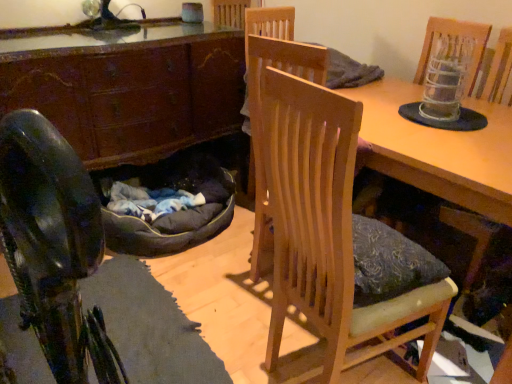
In order to face dark brown wood cabinet at left, should I rotate leftwards or rightwards?

Rotate left and turn 16.317 degrees.

What do you see at coordinates (440, 149) in the screenshot?
I see `wooden table at center` at bounding box center [440, 149].

The height and width of the screenshot is (384, 512). Describe the element at coordinates (319, 215) in the screenshot. I see `wooden chair at center` at that location.

At what (x,y) coordinates should I click in order to perform the action: click on dark gray fabric bean bag at lower left. Please return your answer as a coordinate pair (x, y). This screenshot has height=384, width=512. Looking at the image, I should click on (168, 206).

Is wooden chair at center taller or shorter than dark brown wood cabinet at left?

In the image, wooden chair at center appears to be taller than dark brown wood cabinet at left.

Between point (420, 333) and point (134, 111), which one is positioned in front?

The point (420, 333) is in front.

Which point is more forward, (62, 88) or (175, 186)?

The point (62, 88) is in front.

From the image's perspective, is dark brown wood cabinet at left above or below dark gray fabric bean bag at lower left?

Clearly, from the image's perspective, dark brown wood cabinet at left is above dark gray fabric bean bag at lower left.

The height and width of the screenshot is (384, 512). What are the coordinates of `bean bag chair below the dark brown wood cabinet at left (from a real-world perspective)` in the screenshot? It's located at (168, 206).

From the picture: From a real-world perspective, is dark gray fabric bean bag at lower left located beneath wooden chair at center?

Correct, in the physical world, dark gray fabric bean bag at lower left is lower than wooden chair at center.

From the image's perspective, is dark gray fabric bean bag at lower left under wooden chair at center?

No.

The image size is (512, 384). Find the location of `chair positioned vertically above the dark gray fabric bean bag at lower left (from a real-world perspective)`. chair positioned vertically above the dark gray fabric bean bag at lower left (from a real-world perspective) is located at coordinates (319, 215).

Considering the positions of objects dark gray fabric bean bag at lower left and wooden chair at center in the image provided, who is in front, dark gray fabric bean bag at lower left or wooden chair at center?

Positioned in front is wooden chair at center.

Could you tell me if wooden chair at center is turned towards wooden table at center?

No.

From the image's perspective, which is below, wooden chair at center or wooden table at center?

From the image's view, wooden chair at center is below.

Is the depth of wooden chair at center less than that of wooden table at center?

Yes, wooden chair at center is closer to the viewer.

From a real-world perspective, is wooden chair at center physically located above or below wooden table at center?

wooden chair at center is below wooden table at center.

Considering the relative sizes of dark gray fabric bean bag at lower left and wooden table at center in the image provided, is dark gray fabric bean bag at lower left bigger than wooden table at center?

Incorrect, dark gray fabric bean bag at lower left is not larger than wooden table at center.

In the scene shown: From the image's perspective, between dark gray fabric bean bag at lower left and wooden table at center, which one is located above?

wooden table at center is shown above in the image.

Considering the relative sizes of dark gray fabric bean bag at lower left and wooden table at center in the image provided, is dark gray fabric bean bag at lower left wider than wooden table at center?

Yes, dark gray fabric bean bag at lower left is wider than wooden table at center.

Does dark gray fabric bean bag at lower left appear on the right side of wooden table at center?

Incorrect, dark gray fabric bean bag at lower left is not on the right side of wooden table at center.

Is wooden table at center bigger or smaller than wooden chair at center?

wooden table at center is smaller than wooden chair at center.

Is wooden table at center wider than wooden chair at center?

Yes.

From a real-world perspective, is wooden table at center located higher than wooden chair at center?

Indeed, from a real-world perspective, wooden table at center stands above wooden chair at center.

Which object is closer to the camera taking this photo, wooden table at center or wooden chair at center?

wooden chair at center.

Can you confirm if wooden chair at center is smaller than dark gray fabric bean bag at lower left?

No.

Can you tell me how much wooden chair at center and dark gray fabric bean bag at lower left differ in facing direction?

There is a 89.1-degree angle between the facing directions of wooden chair at center and dark gray fabric bean bag at lower left.

Does point (346, 336) lie behind point (210, 208)?

That is False.

From the image's perspective, between wooden chair at center and dark gray fabric bean bag at lower left, who is located below?

wooden chair at center.

I want to click on chair to the right of dark brown wood cabinet at left, so click(x=319, y=215).

There is a dark gray fabric bean bag at lower left. Identify the location of cabinetry above it (from a real-world perspective). This screenshot has height=384, width=512. tap(128, 87).

Considering their positions, is dark brown wood cabinet at left positioned closer to wooden chair at center than dark gray fabric bean bag at lower left?

The object closer to wooden chair at center is dark gray fabric bean bag at lower left.

When comparing their distances from wooden table at center, does dark gray fabric bean bag at lower left or wooden chair at center seem further?

dark gray fabric bean bag at lower left.

Which object lies further to the anchor point dark gray fabric bean bag at lower left, wooden table at center or dark brown wood cabinet at left?

Based on the image, wooden table at center appears to be further to dark gray fabric bean bag at lower left.

Based on their spatial positions, is wooden table at center or dark brown wood cabinet at left further from wooden chair at center?

Among the two, dark brown wood cabinet at left is located further to wooden chair at center.

Estimate the real-world distances between objects in this image. Which object is further from dark gray fabric bean bag at lower left, dark brown wood cabinet at left or wooden table at center?

Among the two, wooden table at center is located further to dark gray fabric bean bag at lower left.

Looking at this image, when comparing their distances from dark gray fabric bean bag at lower left, does dark brown wood cabinet at left or wooden chair at center seem further?

Among the two, wooden chair at center is located further to dark gray fabric bean bag at lower left.

Based on their spatial positions, is dark gray fabric bean bag at lower left or wooden table at center further from dark brown wood cabinet at left?

Among the two, wooden table at center is located further to dark brown wood cabinet at left.

When comparing their distances from wooden chair at center, does dark brown wood cabinet at left or wooden table at center seem closer?

wooden table at center lies closer to wooden chair at center than the other object.

Identify the location of chair between dark gray fabric bean bag at lower left and wooden table at center from left to right. (319, 215).

The height and width of the screenshot is (384, 512). Identify the location of chair between dark brown wood cabinet at left and wooden table at center in the horizontal direction. (319, 215).

Image resolution: width=512 pixels, height=384 pixels. Find the location of `bean bag chair situated between dark brown wood cabinet at left and wooden table at center from left to right`. bean bag chair situated between dark brown wood cabinet at left and wooden table at center from left to right is located at coordinates (168, 206).

You are a GUI agent. You are given a task and a screenshot of the screen. Output one action in this format:
    pyautogui.click(x=<x>, y=<y>)
    Task: Click on the cabinetry between wooden chair at center and dark gray fabric bean bag at lower left along the z-axis
    The width and height of the screenshot is (512, 384).
    Given the screenshot: What is the action you would take?
    pyautogui.click(x=128, y=87)